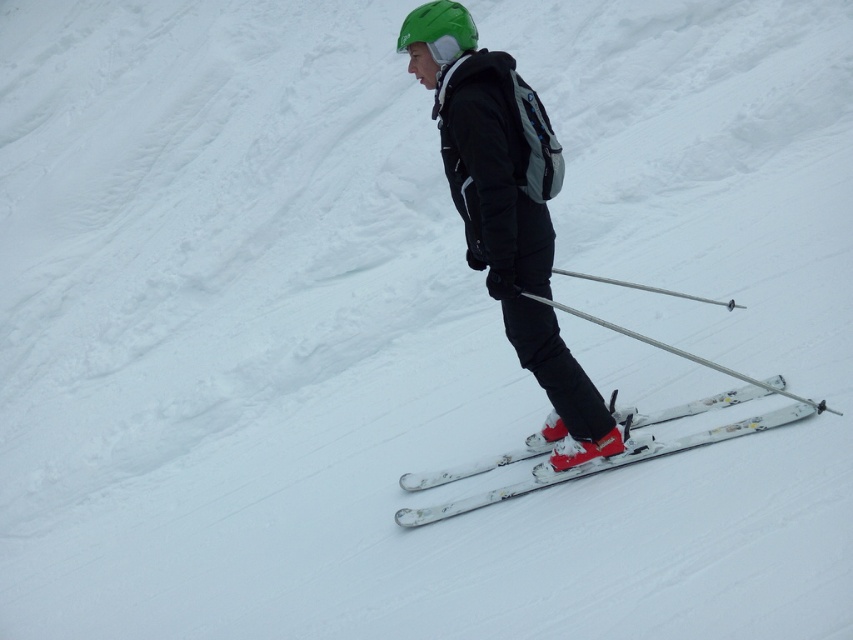
What do you see at coordinates (607, 461) in the screenshot? The width and height of the screenshot is (853, 640). I see `white matte skis at center` at bounding box center [607, 461].

Is the position of white matte skis at center less distant than that of silver metallic ski pole at center?

No, it is behind silver metallic ski pole at center.

Measure the distance between white matte skis at center and camera.

white matte skis at center and camera are 5.60 meters apart.

The image size is (853, 640). What are the coordinates of `white matte skis at center` in the screenshot? It's located at (607, 461).

Locate an element on the screen. The height and width of the screenshot is (640, 853). matte black ski suit at center is located at coordinates (508, 209).

Who is higher up, matte black ski suit at center or silver metallic ski pole at center?

matte black ski suit at center

Between matte black ski suit at center and silver metallic ski pole at center, which one has less height?

silver metallic ski pole at center

Which is behind, point (572, 406) or point (585, 320)?

Positioned behind is point (585, 320).

Find the location of a particular element. matte black ski suit at center is located at coordinates (508, 209).